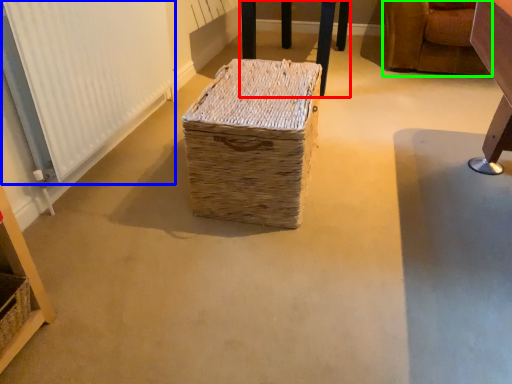
Question: Considering the real-world distances, which object is closest to furniture (highlighted by a red box)? radiator (highlighted by a blue box) or furniture (highlighted by a green box).

Choices:
 (A) radiator
 (B) furniture

Answer: (B)